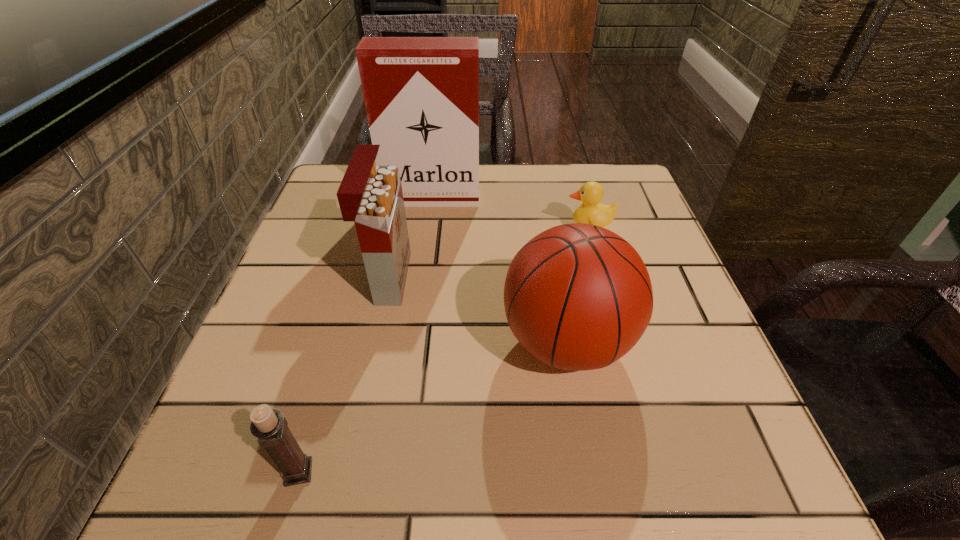
Identify the location of the taller cigarette case. (421, 94).

Identify the location of the tallest object. (421, 94).

Find the location of a particular element. The height and width of the screenshot is (540, 960). the shorter cigarette case is located at coordinates (370, 195).

Where is `basketball`? The width and height of the screenshot is (960, 540). basketball is located at coordinates (577, 296).

This screenshot has height=540, width=960. Find the location of `the fourth tallest object`. the fourth tallest object is located at coordinates (269, 425).

You are a GUI agent. You are given a task and a screenshot of the screen. Output one action in this format:
    pyautogui.click(x=<x>, y=<y>)
    Task: Click on the nearest object
    The image size is (960, 540).
    Given the screenshot: What is the action you would take?
    pyautogui.click(x=269, y=425)

Identify the location of the fourth nearest object. (591, 193).

Where is `the shortest object`? The width and height of the screenshot is (960, 540). the shortest object is located at coordinates (591, 193).

Locate an element on the screen. free space located on the front-facing side of the farther cigarette case is located at coordinates (427, 233).

Where is `vacant space located 0.380m with the lid open on the nearer cigarette case`? vacant space located 0.380m with the lid open on the nearer cigarette case is located at coordinates (603, 278).